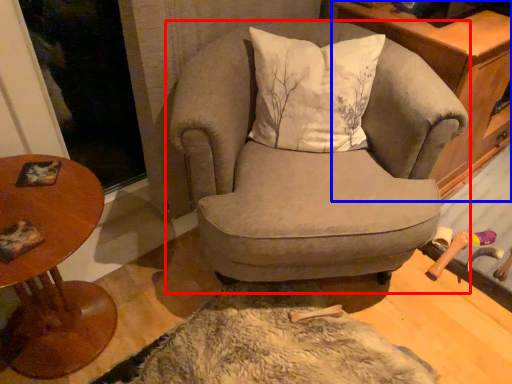
Question: Among these objects, which one is farthest to the camera, chair (highlighted by a red box) or cabinetry (highlighted by a blue box)?

Choices:
 (A) chair
 (B) cabinetry

Answer: (B)